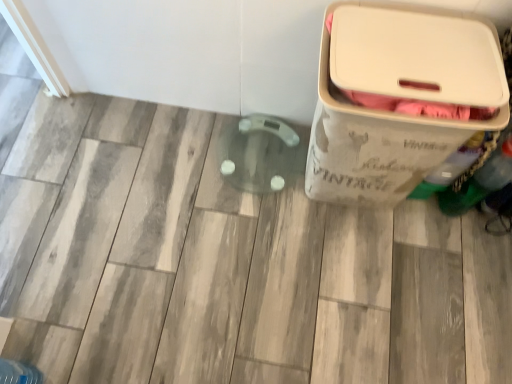
Question: From a real-world perspective, is translucent plastic bottle at upper right positioned above or below beige plastic container at right?

Choices:
 (A) above
 (B) below

Answer: (B)

Question: Which is correct: translucent plastic bottle at upper right is inside beige plastic container at right, or outside of it?

Choices:
 (A) outside
 (B) inside

Answer: (A)

Question: Is translucent plastic bottle at upper right taller or shorter than beige plastic container at right?

Choices:
 (A) tall
 (B) short

Answer: (B)

Question: From a real-world perspective, is beige plastic container at right positioned above or below translucent plastic bottle at upper right?

Choices:
 (A) above
 (B) below

Answer: (A)

Question: Does point (373, 162) appear closer or farther from the camera than point (437, 185)?

Choices:
 (A) farther
 (B) closer

Answer: (B)

Question: From their relative heights in the image, would you say beige plastic container at right is taller or shorter than translucent plastic bottle at upper right?

Choices:
 (A) short
 (B) tall

Answer: (B)

Question: From the image's perspective, is beige plastic container at right above or below translucent plastic bottle at upper right?

Choices:
 (A) below
 (B) above

Answer: (B)